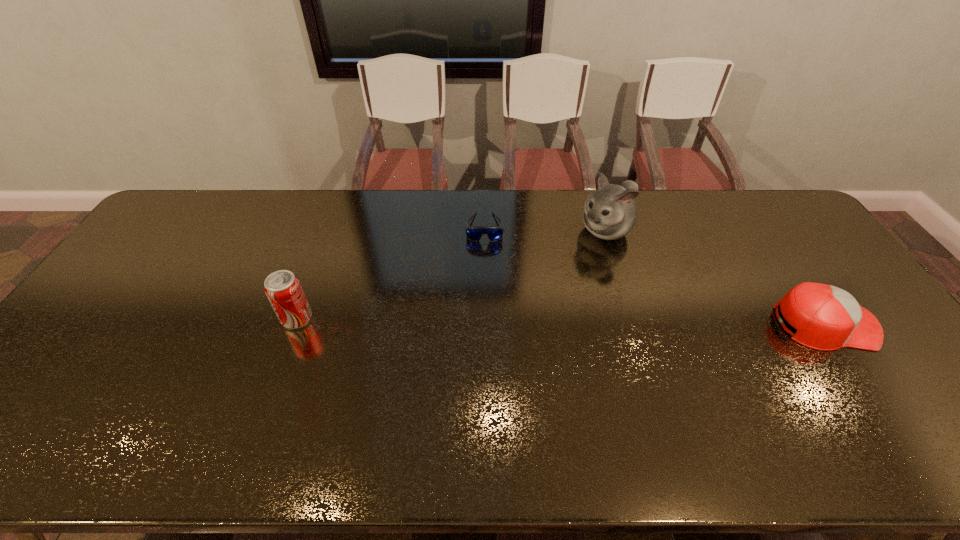
Find the location of a particular element. The height and width of the screenshot is (540, 960). vacant space located 0.080m on the face of the hamster is located at coordinates (576, 256).

Locate an element on the screen. The height and width of the screenshot is (540, 960). free region located 0.070m on the face of the hamster is located at coordinates (578, 255).

This screenshot has height=540, width=960. I want to click on vacant space located on the front-facing side of the second object from left to right, so click(486, 328).

Where is `free space located 0.220m on the front-facing side of the second object from left to right`? free space located 0.220m on the front-facing side of the second object from left to right is located at coordinates (485, 294).

The width and height of the screenshot is (960, 540). Find the location of `vacant space located 0.210m on the front-facing side of the second object from left to right`. vacant space located 0.210m on the front-facing side of the second object from left to right is located at coordinates (485, 292).

You are a GUI agent. You are given a task and a screenshot of the screen. Output one action in this format:
    pyautogui.click(x=<x>, y=<y>)
    Task: Click on the hamster that is at the far edge
    The image size is (960, 540).
    Given the screenshot: What is the action you would take?
    pyautogui.click(x=610, y=213)

Where is `sunglasses present at the far edge`? This screenshot has height=540, width=960. sunglasses present at the far edge is located at coordinates (474, 233).

The height and width of the screenshot is (540, 960). I want to click on object that is at the right edge, so click(826, 318).

Where is `free space at the far edge of the desktop`? free space at the far edge of the desktop is located at coordinates coord(481,193).

Find the location of a particular element. The height and width of the screenshot is (540, 960). vacant space at the near edge of the desktop is located at coordinates (226, 392).